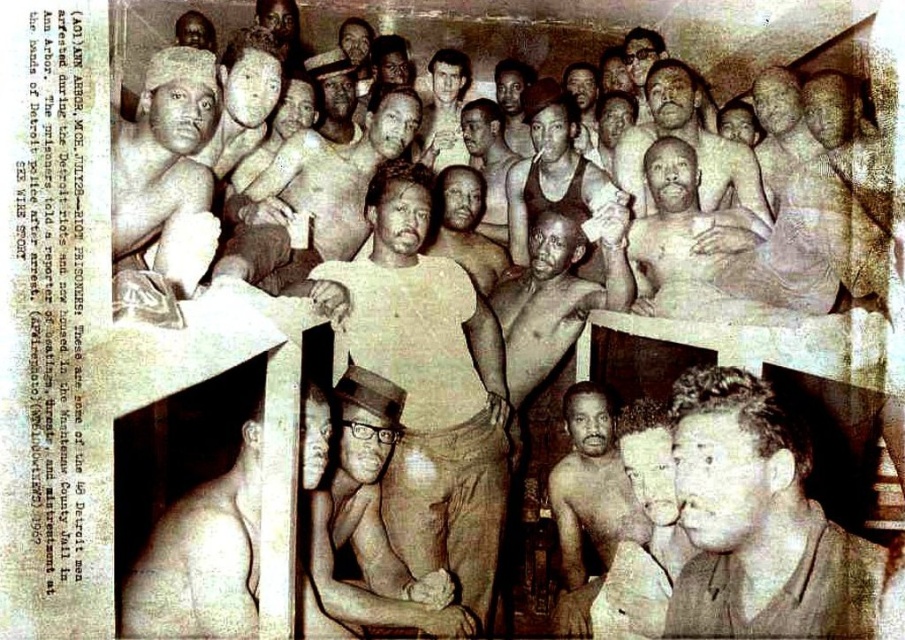
You are a photographer analyzing this historical image. You notice the light beige cotton shirt at center and the dark brown leather jacket at center. From the perspective of someone standing in front of the image, which object is positioned to the right?

The dark brown leather jacket at center is positioned to the right of the light beige cotton shirt at center.